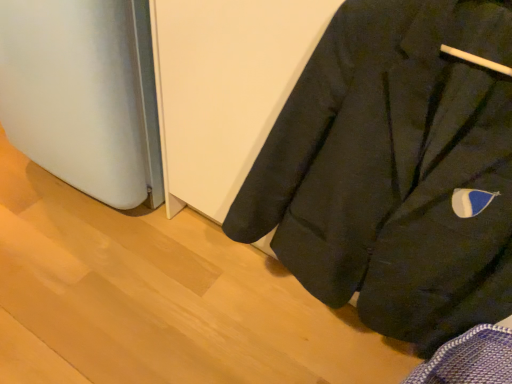
Where is `satin white refrigerator at lower left`? The image size is (512, 384). satin white refrigerator at lower left is located at coordinates (84, 95).

Measure the distance between point (105, 8) and camera.

Point (105, 8) is 35.71 inches away from camera.

What do you see at coordinates (84, 95) in the screenshot? I see `satin white refrigerator at lower left` at bounding box center [84, 95].

In order to face black matte coat at lower right, should I rotate leftwards or rightwards?

Turn right by 16.344 degrees to look at black matte coat at lower right.

This screenshot has height=384, width=512. Describe the element at coordinates (394, 169) in the screenshot. I see `black matte coat at lower right` at that location.

Where is `black matte coat at lower right`? The image size is (512, 384). black matte coat at lower right is located at coordinates (394, 169).

Locate an element on the screen. The image size is (512, 384). satin white refrigerator at lower left is located at coordinates (x=84, y=95).

Based on their positions, is satin white refrigerator at lower left located to the left or right of black matte coat at lower right?

From the image, it's evident that satin white refrigerator at lower left is to the left of black matte coat at lower right.

Is the position of satin white refrigerator at lower left more distant than that of black matte coat at lower right?

Yes, the depth of satin white refrigerator at lower left is greater than that of black matte coat at lower right.

Between point (142, 124) and point (451, 186), which one is positioned behind?

The point (142, 124) is farther.

From the image's perspective, relative to black matte coat at lower right, is satin white refrigerator at lower left above or below?

Based on their image positions, satin white refrigerator at lower left is located above black matte coat at lower right.

From a real-world perspective, is satin white refrigerator at lower left physically below black matte coat at lower right?

Correct, in the physical world, satin white refrigerator at lower left is lower than black matte coat at lower right.

Looking at this image, is satin white refrigerator at lower left thinner than black matte coat at lower right?

In fact, satin white refrigerator at lower left might be wider than black matte coat at lower right.

Between satin white refrigerator at lower left and black matte coat at lower right, which one has less height?

satin white refrigerator at lower left.

Based on their sizes in the image, would you say satin white refrigerator at lower left is bigger or smaller than black matte coat at lower right?

In the image, satin white refrigerator at lower left appears to be larger than black matte coat at lower right.

Does satin white refrigerator at lower left contain black matte coat at lower right?

No, satin white refrigerator at lower left does not contain black matte coat at lower right.

Would you consider satin white refrigerator at lower left to be distant from black matte coat at lower right?

No, satin white refrigerator at lower left is not far from black matte coat at lower right.

Could you tell me if satin white refrigerator at lower left is facing black matte coat at lower right?

No, satin white refrigerator at lower left does not turn towards black matte coat at lower right.

How many degrees apart are the facing directions of satin white refrigerator at lower left and black matte coat at lower right?

3.53 degrees.

Measure the distance between satin white refrigerator at lower left and black matte coat at lower right.

satin white refrigerator at lower left and black matte coat at lower right are 24.15 inches apart from each other.

The width and height of the screenshot is (512, 384). Find the location of `appliance above the black matte coat at lower right (from the image's perspective)`. appliance above the black matte coat at lower right (from the image's perspective) is located at coordinates (84, 95).

Is black matte coat at lower right to the left or to the right of satin white refrigerator at lower left in the image?

In the image, black matte coat at lower right appears on the right side of satin white refrigerator at lower left.

Relative to satin white refrigerator at lower left, is black matte coat at lower right in front or behind?

black matte coat at lower right is in front of satin white refrigerator at lower left.

Which is behind, point (317, 177) or point (56, 161)?

The point (56, 161) is farther from the camera.

From the image's perspective, between black matte coat at lower right and satin white refrigerator at lower left, who is located below?

black matte coat at lower right appears lower in the image.

From a real-world perspective, is black matte coat at lower right physically located above or below satin white refrigerator at lower left?

black matte coat at lower right is above satin white refrigerator at lower left.

Is black matte coat at lower right wider or thinner than satin white refrigerator at lower left?

Considering their sizes, black matte coat at lower right looks slimmer than satin white refrigerator at lower left.

Based on the photo, does black matte coat at lower right have a greater height compared to satin white refrigerator at lower left?

Yes.

In terms of size, does black matte coat at lower right appear bigger or smaller than satin white refrigerator at lower left?

black matte coat at lower right is smaller than satin white refrigerator at lower left.

Is black matte coat at lower right inside the boundaries of satin white refrigerator at lower left, or outside?

black matte coat at lower right is not inside satin white refrigerator at lower left, it's outside.

Are black matte coat at lower right and satin white refrigerator at lower left located far from each other?

No, black matte coat at lower right is not far from satin white refrigerator at lower left.

Is black matte coat at lower right aimed at satin white refrigerator at lower left?

No, black matte coat at lower right is not aimed at satin white refrigerator at lower left.

How different are the orientations of black matte coat at lower right and satin white refrigerator at lower left in degrees?

The facing directions of black matte coat at lower right and satin white refrigerator at lower left are 3.53 degrees apart.

Measure the distance from black matte coat at lower right to satin white refrigerator at lower left.

They are 24.15 inches apart.

Find the location of a particular element. This screenshot has width=512, height=384. coat on the right side of satin white refrigerator at lower left is located at coordinates (394, 169).

At what (x,y) coordinates should I click in order to perform the action: click on appliance behind the black matte coat at lower right. Please return your answer as a coordinate pair (x, y). Looking at the image, I should click on (84, 95).

Find the location of a particular element. appliance below the black matte coat at lower right (from a real-world perspective) is located at coordinates (84, 95).